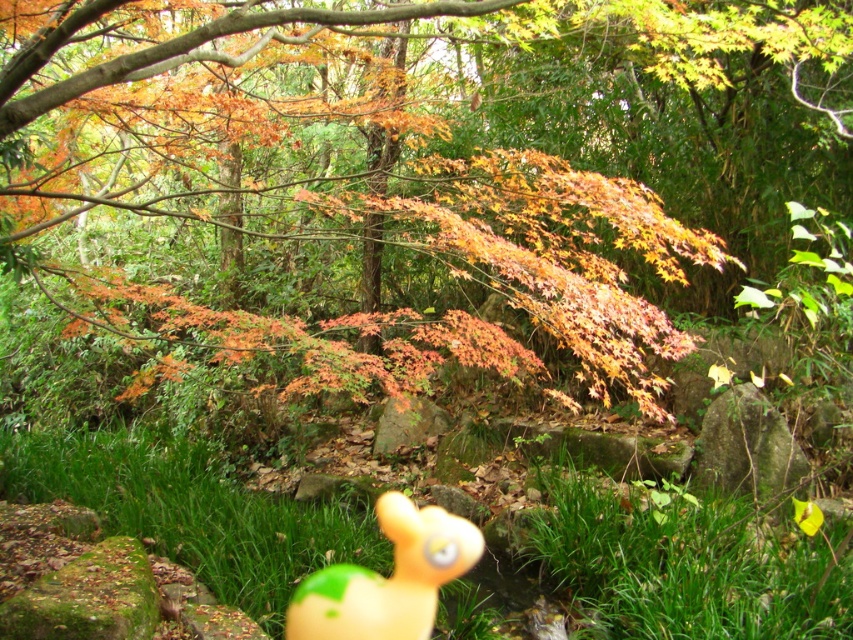
Question: Which is nearer to the green leafy grass at lower center?

Choices:
 (A) rubber duck at center
 (B) green grass at lower center

Answer: (A)

Question: Which point appears farthest from the camera in this image?

Choices:
 (A) (718, 577)
 (B) (286, 611)
 (C) (279, 632)

Answer: (A)

Question: Does green leafy grass at lower center have a larger size compared to rubber duck at center?

Choices:
 (A) no
 (B) yes

Answer: (B)

Question: Can you confirm if green leafy grass at lower center is wider than rubber duck at center?

Choices:
 (A) yes
 (B) no

Answer: (A)

Question: Which object is closer to the camera taking this photo?

Choices:
 (A) green leafy grass at lower center
 (B) rubber duck at center

Answer: (A)

Question: Does green grass at lower center appear under rubber duck at center?

Choices:
 (A) no
 (B) yes

Answer: (A)